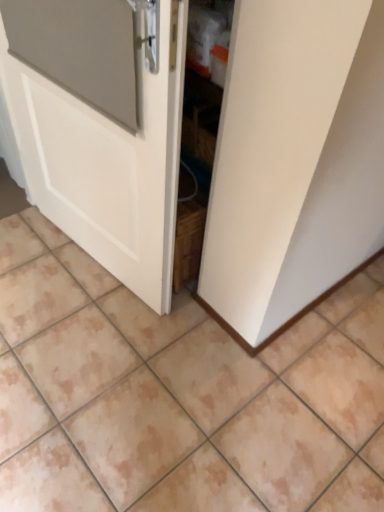
This screenshot has width=384, height=512. What are the coordinates of `vacant region above beige ceramic tile at center (from a real-world perspective)` in the screenshot? It's located at (164, 344).